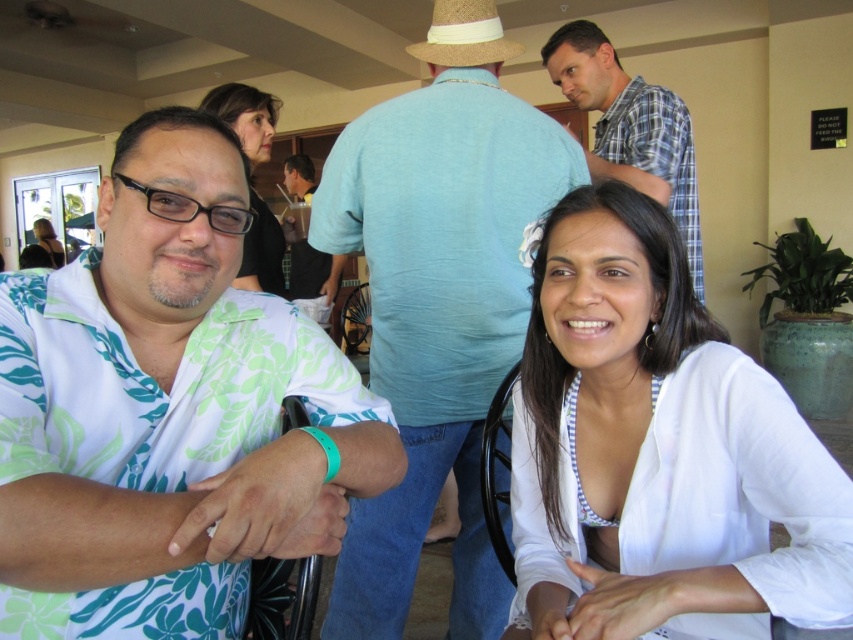
Is plaid cotton shirt at upper center to the right of green rubber wheelchair at lower left from the viewer's perspective?

Yes, plaid cotton shirt at upper center is to the right of green rubber wheelchair at lower left.

Can you confirm if plaid cotton shirt at upper center is thinner than green rubber wheelchair at lower left?

In fact, plaid cotton shirt at upper center might be wider than green rubber wheelchair at lower left.

Measure the distance between plaid cotton shirt at upper center and camera.

A distance of 1.84 meters exists between plaid cotton shirt at upper center and camera.

The image size is (853, 640). Find the location of `plaid cotton shirt at upper center`. plaid cotton shirt at upper center is located at coordinates pyautogui.click(x=630, y=122).

Measure the distance between white floral shirt at left and camera.

white floral shirt at left is 23.34 inches away from camera.

Between white floral shirt at left and white textured blouse at center, which one is positioned lower?

white textured blouse at center is lower down.

Locate an element on the screen. white floral shirt at left is located at coordinates (167, 410).

Can you confirm if green rubber wheelchair at lower left is taller than matte black hair at upper left?

No.

Between green rubber wheelchair at lower left and matte black hair at upper left, which one is positioned higher?

matte black hair at upper left is higher up.

What do you see at coordinates (281, 598) in the screenshot? I see `green rubber wheelchair at lower left` at bounding box center [281, 598].

Locate an element on the screen. green rubber wheelchair at lower left is located at coordinates (281, 598).